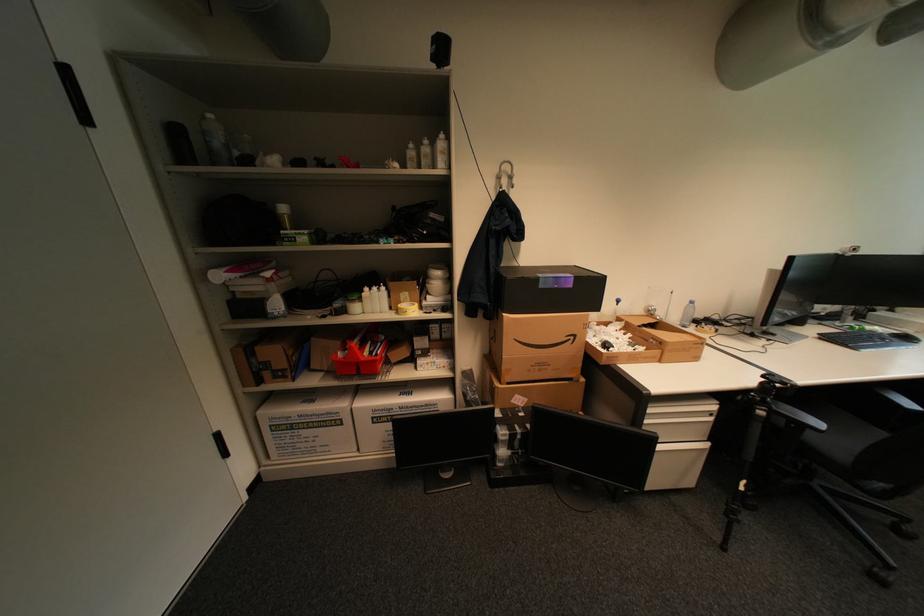
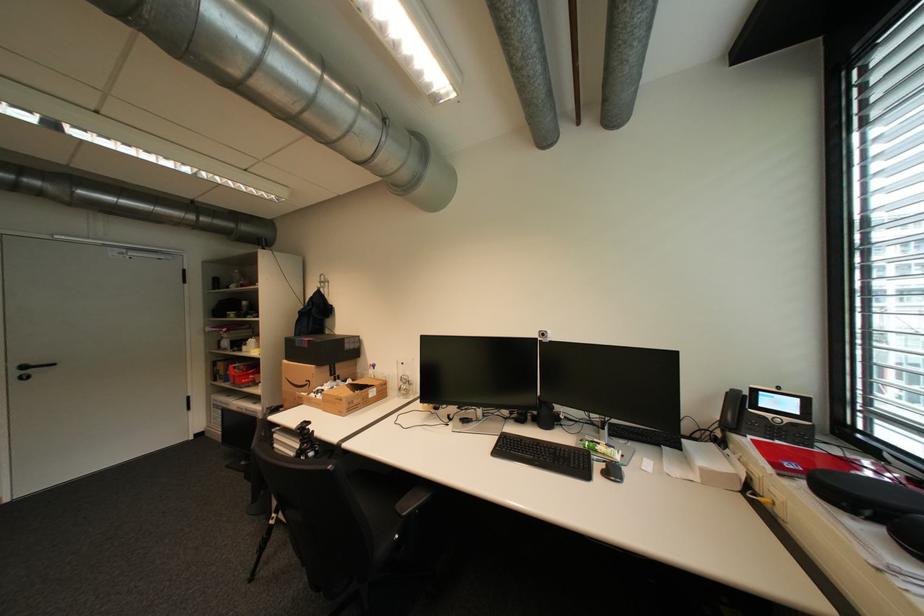
In the second image, find the point that corresponds to (580,338) in the first image.

(317, 383)